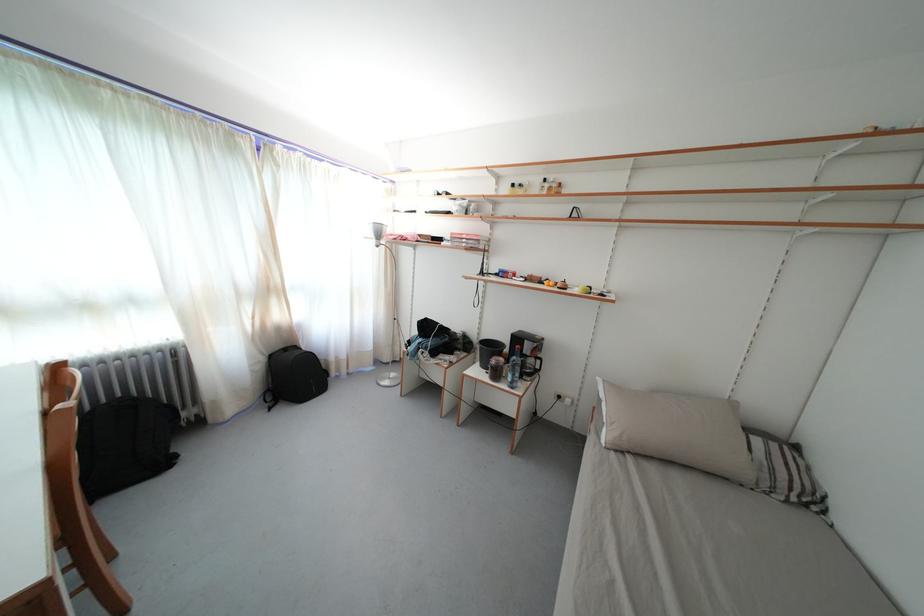
Identify the location of chair sitting surface. This screenshot has height=616, width=924. (74, 562).